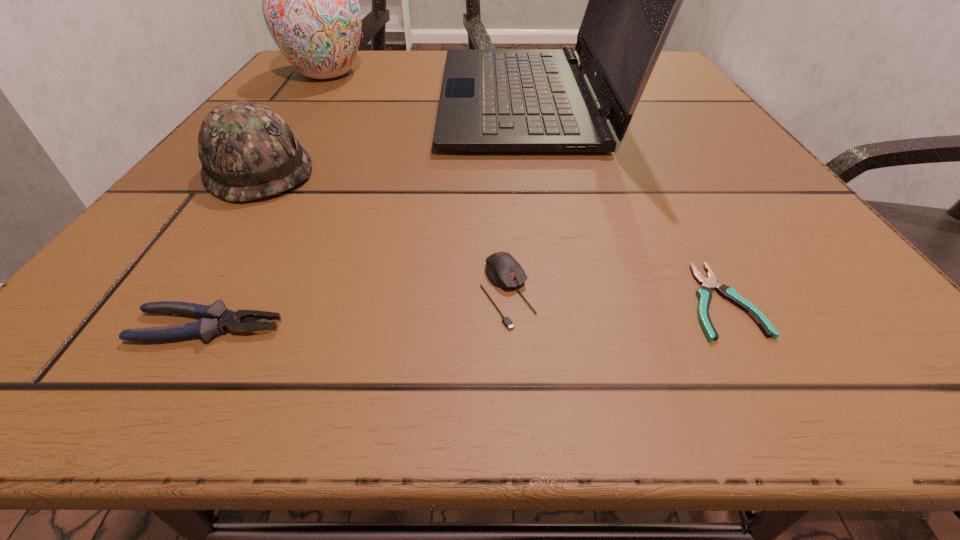
Find the location of a particular element. laptop computer is located at coordinates (492, 100).

This screenshot has width=960, height=540. Find the location of `vase`. vase is located at coordinates (310, 4).

At what (x,y) coordinates should I click in order to perform the action: click on the third tallest object. Please return your answer as a coordinate pair (x, y). The height and width of the screenshot is (540, 960). Looking at the image, I should click on (247, 151).

The height and width of the screenshot is (540, 960). I want to click on the fourth tallest object, so click(x=504, y=272).

I want to click on the second shortest object, so click(215, 318).

The image size is (960, 540). In order to click on the left pliers in this screenshot , I will do `click(215, 318)`.

I want to click on the shortest object, so click(x=704, y=293).

The width and height of the screenshot is (960, 540). I want to click on the right pliers, so click(x=704, y=293).

This screenshot has height=540, width=960. Identify the location of vacant region located on the screen of the laptop computer. (314, 99).

Locate an element on the screen. vacant space located 0.300m on the screen of the laptop computer is located at coordinates (288, 99).